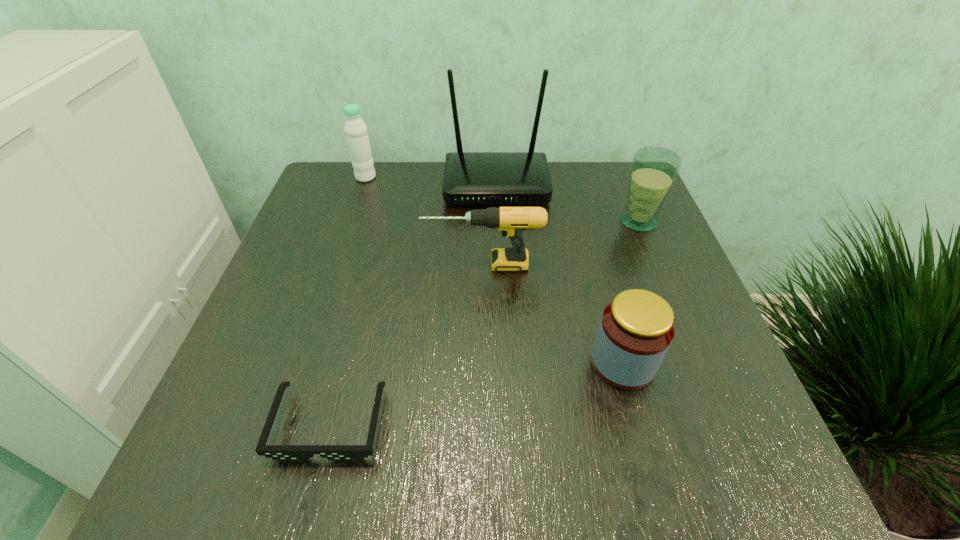
Image resolution: width=960 pixels, height=540 pixels. I want to click on the tallest object, so click(470, 178).

This screenshot has width=960, height=540. Identify the location of water bottle. (355, 129).

The image size is (960, 540). Identify the location of glass. (654, 170).

Locate an element on the screen. drill is located at coordinates (512, 221).

Locate an element on the screen. the fifth object from left to right is located at coordinates pos(636,329).

Where is `the shortest object`? the shortest object is located at coordinates (284, 453).

What are the coordinates of `vacant space located on the front-facing side of the router` in the screenshot? It's located at (501, 298).

What are the coordinates of `vacant space located on the right of the water bottle` in the screenshot? It's located at [413, 177].

Identify the location of free space located on the left of the glass. Image resolution: width=960 pixels, height=540 pixels. (516, 221).

You are a GUI agent. You are given a task and a screenshot of the screen. Output one action in this format:
    pyautogui.click(x=<x>, y=<y>)
    Task: Click on the free space located 0.170m on the handle side of the drill
    Image resolution: width=960 pixels, height=540 pixels.
    Given the screenshot: What is the action you would take?
    pyautogui.click(x=345, y=265)